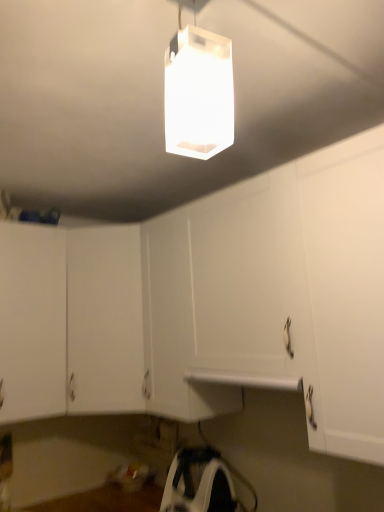
Question: Considering the relative sizes of transparent plastic lamp at upper center and white plastic iron at lower center in the image provided, is transparent plastic lamp at upper center shorter than white plastic iron at lower center?

Choices:
 (A) yes
 (B) no

Answer: (B)

Question: Is transparent plastic lamp at upper center wider than white plastic iron at lower center?

Choices:
 (A) yes
 (B) no

Answer: (B)

Question: Is transparent plastic lamp at upper center facing away from white plastic iron at lower center?

Choices:
 (A) yes
 (B) no

Answer: (B)

Question: Is transparent plastic lamp at upper center in contact with white plastic iron at lower center?

Choices:
 (A) yes
 (B) no

Answer: (B)

Question: Is transparent plastic lamp at upper center positioned behind white plastic iron at lower center?

Choices:
 (A) no
 (B) yes

Answer: (A)

Question: Is transparent plastic lamp at upper center positioned far away from white plastic iron at lower center?

Choices:
 (A) yes
 (B) no

Answer: (A)

Question: Is transparent plastic lamp at upper center turned away from white matte cabinet at center, which is the 1th cabinetry from right to left?

Choices:
 (A) no
 (B) yes

Answer: (A)

Question: Is transparent plastic lamp at upper center in front of white matte cabinet at center, which appears as the second cabinetry when viewed from the left?

Choices:
 (A) no
 (B) yes

Answer: (B)

Question: Considering the relative sizes of transparent plastic lamp at upper center and white matte cabinet at center, which appears as the second cabinetry when viewed from the left, in the image provided, is transparent plastic lamp at upper center smaller than white matte cabinet at center, which appears as the second cabinetry when viewed from the left,?

Choices:
 (A) yes
 (B) no

Answer: (A)

Question: Is transparent plastic lamp at upper center wider than white matte cabinet at center, which is the 1th cabinetry from right to left?

Choices:
 (A) yes
 (B) no

Answer: (B)

Question: Is transparent plastic lamp at upper center at the left side of white matte cabinet at center, which is the 1th cabinetry from right to left?

Choices:
 (A) no
 (B) yes

Answer: (A)

Question: Considering the relative positions of transparent plastic lamp at upper center and white matte cabinet at center, which appears as the second cabinetry when viewed from the left, in the image provided, is transparent plastic lamp at upper center behind white matte cabinet at center, which appears as the second cabinetry when viewed from the left,?

Choices:
 (A) yes
 (B) no

Answer: (B)

Question: Is white matte cabinet at center, which is the 1th cabinetry from right to left, to the right of transparent plastic lamp at upper center from the viewer's perspective?

Choices:
 (A) yes
 (B) no

Answer: (B)